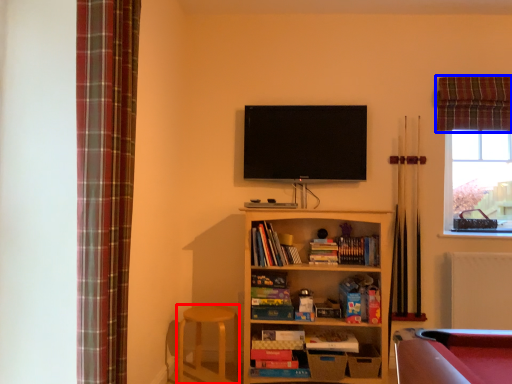
Question: Which of the following is the closest to the observer, bar stool (highlighted by a red box) or curtain (highlighted by a blue box)?

Choices:
 (A) bar stool
 (B) curtain

Answer: (A)